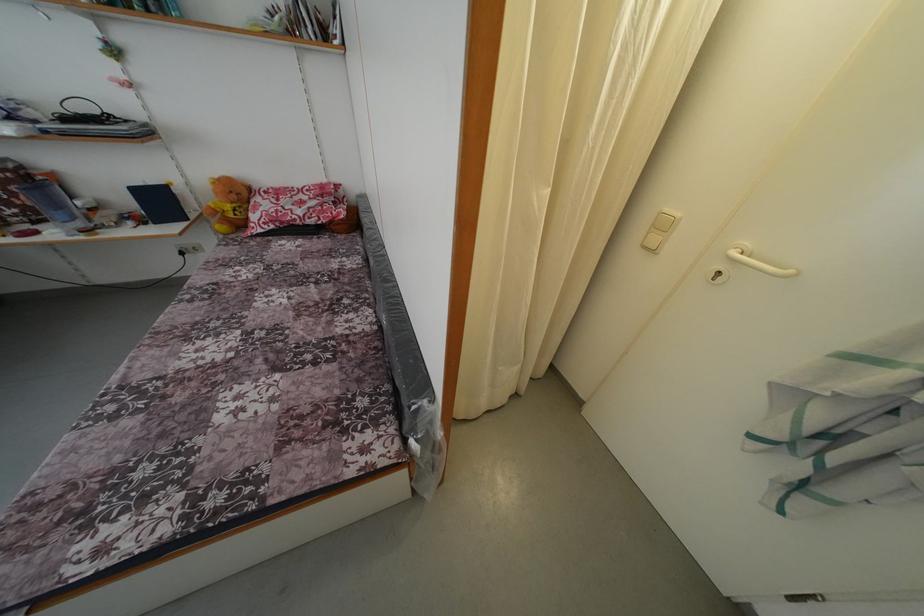
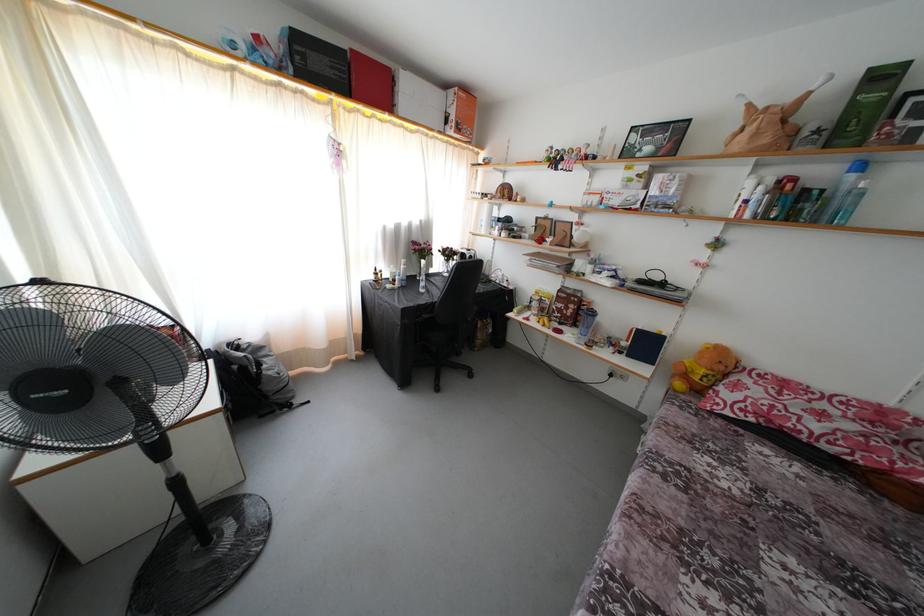
In the second image, find the point that corresponds to point 239,203 in the first image.

(726, 373)